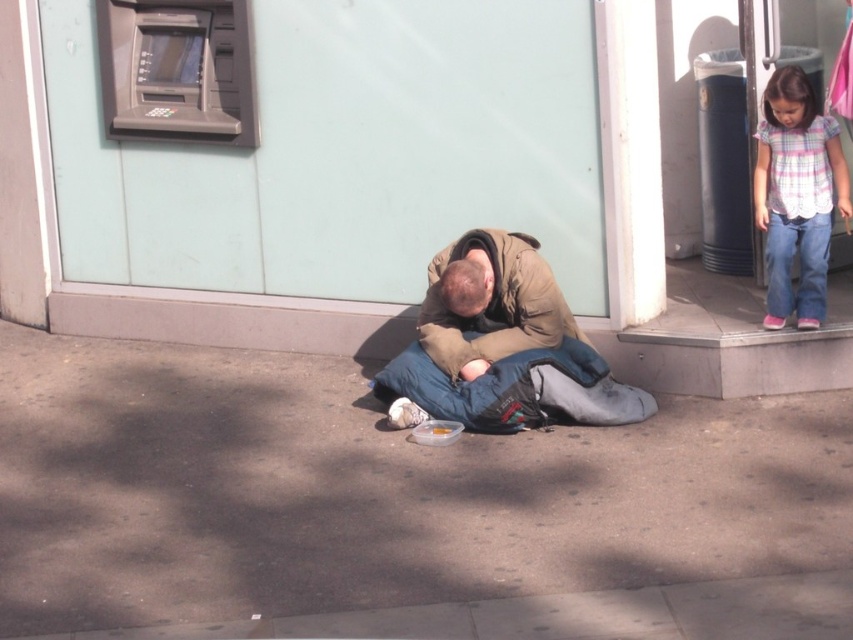
Question: Is brown concrete pavement at center smaller than pink plaid shirt at upper right?

Choices:
 (A) no
 (B) yes

Answer: (A)

Question: Is pink plaid shirt at upper right positioned behind blue fabric sleeping bag at center?

Choices:
 (A) yes
 (B) no

Answer: (A)

Question: Which object is closer to the camera taking this photo?

Choices:
 (A) blue fabric sleeping bag at center
 (B) pink plaid shirt at upper right

Answer: (A)

Question: Does pink plaid shirt at upper right lie in front of blue fabric sleeping bag at center?

Choices:
 (A) yes
 (B) no

Answer: (B)

Question: Considering the real-world distances, which object is closest to the blue fabric sleeping bag at center?

Choices:
 (A) pink plaid shirt at upper right
 (B) brown fuzzy jacket at center
 (C) brown concrete pavement at center

Answer: (B)

Question: Which object is closer to the camera taking this photo?

Choices:
 (A) brown concrete pavement at center
 (B) brown fuzzy jacket at center
 (C) blue fabric sleeping bag at center

Answer: (A)